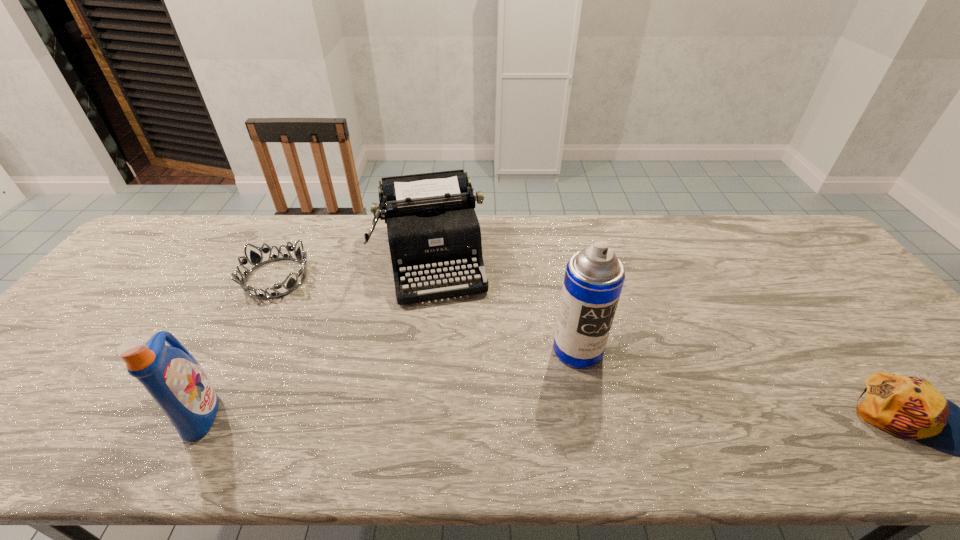
Where is `vacant space on the desktop that is between the second tallest object and the second shortest object and is positioned on the typing side of the third object from right to left`? Image resolution: width=960 pixels, height=540 pixels. vacant space on the desktop that is between the second tallest object and the second shortest object and is positioned on the typing side of the third object from right to left is located at coordinates (464, 414).

Where is `free spot on the desktop that is between the second tallest object and the rightmost object and is positioned on the front-facing side of the shortest object`? Image resolution: width=960 pixels, height=540 pixels. free spot on the desktop that is between the second tallest object and the rightmost object and is positioned on the front-facing side of the shortest object is located at coordinates (469, 415).

Find the location of a particular element. The height and width of the screenshot is (540, 960). vacant space on the desktop that is between the fourth shortest object and the fourth tallest object and is positioned on the label side of the tallest object is located at coordinates (646, 416).